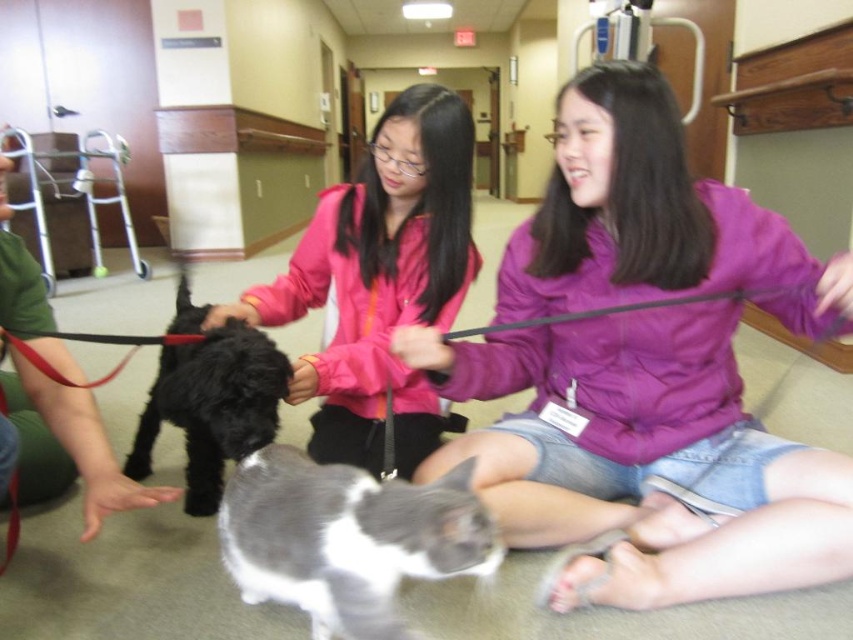
Question: Is matte pink jacket at center wider than black matte dog at center?

Choices:
 (A) yes
 (B) no

Answer: (A)

Question: Which point is farther to the camera?

Choices:
 (A) (352, 397)
 (B) (90, 500)
 (C) (550, 320)

Answer: (A)

Question: Considering the real-world distances, which object is closest to the black matte leash at center?

Choices:
 (A) black matte dog at left
 (B) black matte dog at center

Answer: (B)

Question: Where is purple satin jacket at center located in relation to black matte leash at center in the image?

Choices:
 (A) right
 (B) left

Answer: (B)

Question: Where is black matte dog at center located in relation to black matte dog at left in the image?

Choices:
 (A) left
 (B) right

Answer: (B)

Question: Among these points, which one is farthest from the camera?

Choices:
 (A) (267, 433)
 (B) (610, 394)
 (C) (711, 298)

Answer: (B)